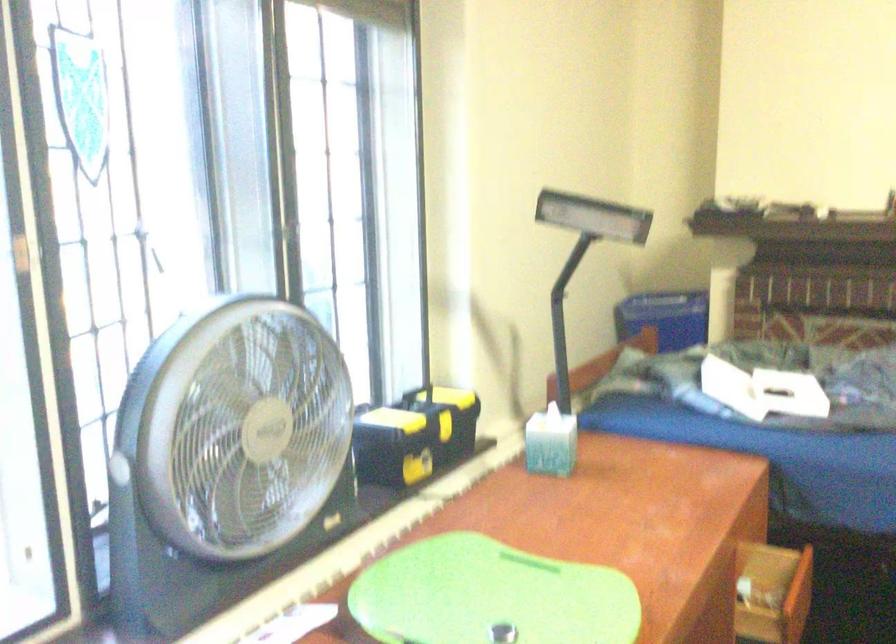
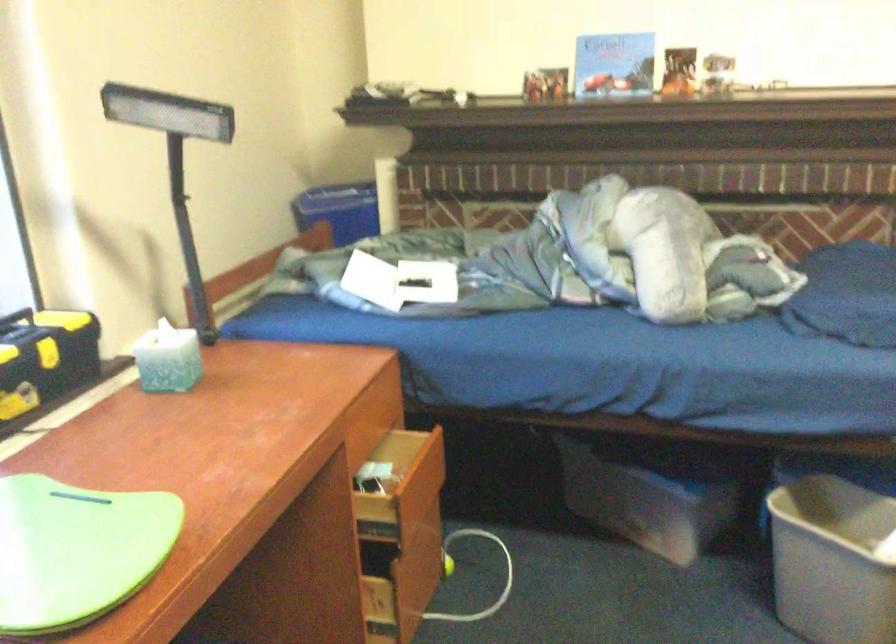
Question: Based on the continuous images, in which direction is the camera rotating? Reply with the corresponding letter.

Choices:
 (A) Left
 (B) Right
 (C) Up
 (D) Down

Answer: (B)